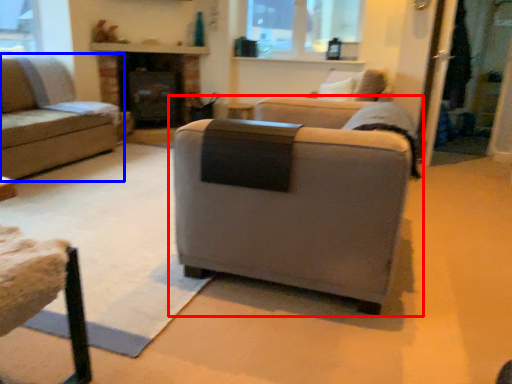
Question: Which object is further to the camera taking this photo, studio couch (highlighted by a red box) or studio couch (highlighted by a blue box)?

Choices:
 (A) studio couch
 (B) studio couch

Answer: (B)